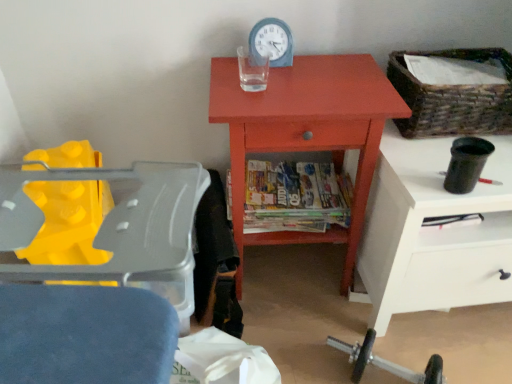
In order to click on vacant space that is in between matte orange cabinet at center and white glossy nightstand at right in this screenshot , I will do `click(316, 318)`.